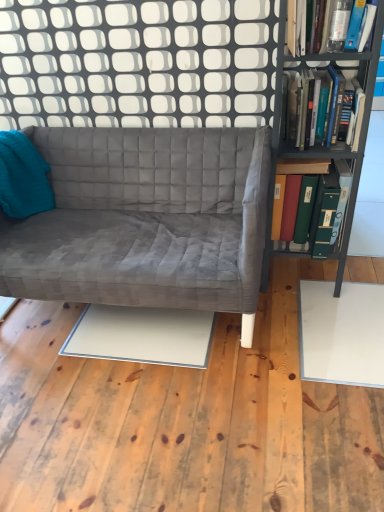
Describe the element at coordinates (320, 208) in the screenshot. The height and width of the screenshot is (512, 384). I see `green matte folder at right, the third book viewed from the top` at that location.

Describe the element at coordinates (23, 177) in the screenshot. I see `teal fabric throw pillow at left` at that location.

The width and height of the screenshot is (384, 512). What are the coordinates of `transparent glass door at upper center` in the screenshot? It's located at (138, 63).

What is the approximate width of hardcover books at right, which ranks as the second book in top-to-bottom order?

It is 33.45 centimeters.

The height and width of the screenshot is (512, 384). Describe the element at coordinates (325, 22) in the screenshot. I see `matte plastic book at upper right, placed as the third book when sorted from bottom to top` at that location.

In order to face matte plastic book at upper right, placed as the third book when sorted from bottom to top, should I rotate leftwards or rightwards?

You should rotate right by 18.148 degrees.

Image resolution: width=384 pixels, height=512 pixels. Describe the element at coordinates (323, 148) in the screenshot. I see `metallic gray bookcase at right` at that location.

This screenshot has height=512, width=384. I want to click on green matte folder at right, the third book viewed from the top, so click(320, 208).

Measure the distance from green matte folder at right, the third book viewed from the top, to teal fabric throw pillow at left.

green matte folder at right, the third book viewed from the top, and teal fabric throw pillow at left are 1.21 meters apart from each other.

Considering the points (313, 196) and (7, 179), which point is in front, point (313, 196) or point (7, 179)?

The point (313, 196) is more forward.

Based on the photo, are green matte folder at right, marked as the first book in a bottom-to-top arrangement, and teal fabric throw pillow at left far apart?

Indeed, green matte folder at right, marked as the first book in a bottom-to-top arrangement, is not near teal fabric throw pillow at left.

Can you confirm if green matte folder at right, the third book viewed from the top, is thinner than teal fabric throw pillow at left?

No, green matte folder at right, the third book viewed from the top, is not thinner than teal fabric throw pillow at left.

Looking at this image, is transparent glass door at upper center inside hardcover books at right, which ranks as the second book in top-to-bottom order?

No, transparent glass door at upper center is not a part of hardcover books at right, which ranks as the second book in top-to-bottom order.

Is the position of hardcover books at right, which ranks as the second book in top-to-bottom order, more distant than that of transparent glass door at upper center?

That is False.

Measure the distance between hardcover books at right, which is the 2th book from bottom to top, and transparent glass door at upper center.

hardcover books at right, which is the 2th book from bottom to top, is 19.53 inches from transparent glass door at upper center.

From the picture: Is hardcover books at right, which is the 2th book from bottom to top, turned away from transparent glass door at upper center?

Correct, hardcover books at right, which is the 2th book from bottom to top, is looking away from transparent glass door at upper center.

Could you tell me if teal fabric throw pillow at left is turned towards transparent glass door at upper center?

No, teal fabric throw pillow at left is not turned towards transparent glass door at upper center.

Based on the photo, is teal fabric throw pillow at left taller than transparent glass door at upper center?

Incorrect, the height of teal fabric throw pillow at left is not larger of that of transparent glass door at upper center.

Is teal fabric throw pillow at left further to camera compared to transparent glass door at upper center?

Yes, it is behind transparent glass door at upper center.

Between teal fabric throw pillow at left and transparent glass door at upper center, which one has larger width?

With larger width is teal fabric throw pillow at left.

Is matte plastic book at upper right, placed as the third book when sorted from bottom to top, inside hardcover books at right, which is the 2th book from bottom to top?

No, matte plastic book at upper right, placed as the third book when sorted from bottom to top, is not inside hardcover books at right, which is the 2th book from bottom to top.

Is hardcover books at right, which is the 2th book from bottom to top, at the right side of matte plastic book at upper right, placed as the third book when sorted from bottom to top?

Yes, hardcover books at right, which is the 2th book from bottom to top, is to the right of matte plastic book at upper right, placed as the third book when sorted from bottom to top.

Between hardcover books at right, which ranks as the second book in top-to-bottom order, and matte plastic book at upper right, placed as the third book when sorted from bottom to top, which one has less height?

matte plastic book at upper right, placed as the third book when sorted from bottom to top, is shorter.

Considering the relative sizes of hardcover books at right, which is the 2th book from bottom to top, and matte plastic book at upper right, arranged as the 1th book when viewed from the top, in the image provided, is hardcover books at right, which is the 2th book from bottom to top, bigger than matte plastic book at upper right, arranged as the 1th book when viewed from the top,?

Indeed, hardcover books at right, which is the 2th book from bottom to top, has a larger size compared to matte plastic book at upper right, arranged as the 1th book when viewed from the top.

Which object is wider, transparent glass door at upper center or green matte folder at right, marked as the first book in a bottom-to-top arrangement?

green matte folder at right, marked as the first book in a bottom-to-top arrangement, is wider.

From a real-world perspective, between transparent glass door at upper center and green matte folder at right, marked as the first book in a bottom-to-top arrangement, who is vertically higher?

transparent glass door at upper center, from a real-world perspective.

In the scene shown: Choose the correct answer: Is transparent glass door at upper center inside green matte folder at right, the third book viewed from the top, or outside it?

transparent glass door at upper center exists outside the volume of green matte folder at right, the third book viewed from the top.

Which of these two, teal fabric throw pillow at left or white glossy plywood at lower center, is wider?

With larger width is white glossy plywood at lower center.

Considering the sizes of objects teal fabric throw pillow at left and white glossy plywood at lower center in the image provided, who is taller, teal fabric throw pillow at left or white glossy plywood at lower center?

teal fabric throw pillow at left.

Relative to white glossy plywood at lower center, is teal fabric throw pillow at left in front or behind?

teal fabric throw pillow at left is behind white glossy plywood at lower center.

Is teal fabric throw pillow at left surrounding white glossy plywood at lower center?

No, white glossy plywood at lower center is located outside of teal fabric throw pillow at left.

Which is in front, point (295, 0) or point (379, 451)?

Point (379, 451)

Does matte plastic book at upper right, placed as the third book when sorted from bottom to top, have a lesser width compared to white glossy plywood at lower center?

Indeed, matte plastic book at upper right, placed as the third book when sorted from bottom to top, has a lesser width compared to white glossy plywood at lower center.

Considering the sizes of objects matte plastic book at upper right, placed as the third book when sorted from bottom to top, and white glossy plywood at lower center in the image provided, who is smaller, matte plastic book at upper right, placed as the third book when sorted from bottom to top, or white glossy plywood at lower center?

With smaller size is matte plastic book at upper right, placed as the third book when sorted from bottom to top.

Image resolution: width=384 pixels, height=512 pixels. In order to click on throw pillow behind the green matte folder at right, the third book viewed from the top in this screenshot , I will do `click(23, 177)`.

Which book is the 1st one when counting from the front of the transparent glass door at upper center? Please provide its 2D coordinates.

[(319, 106)]

When comparing their distances from matte plastic book at upper right, placed as the third book when sorted from bottom to top, does white glossy plywood at lower center or transparent glass door at upper center seem closer?

Among the two, transparent glass door at upper center is located nearer to matte plastic book at upper right, placed as the third book when sorted from bottom to top.

From the image, which object appears to be nearer to hardcover books at right, which ranks as the second book in top-to-bottom order, teal fabric throw pillow at left or velvet gray couch at center?

Based on the image, velvet gray couch at center appears to be nearer to hardcover books at right, which ranks as the second book in top-to-bottom order.

Based on their spatial positions, is velvet gray couch at center or matte plastic book at upper right, placed as the third book when sorted from bottom to top, further from teal fabric throw pillow at left?

Based on the image, matte plastic book at upper right, placed as the third book when sorted from bottom to top, appears to be further to teal fabric throw pillow at left.

Which object lies nearer to the anchor point hardcover books at right, which ranks as the second book in top-to-bottom order, teal fabric throw pillow at left or white glossy plywood at lower center?

Among the two, white glossy plywood at lower center is located nearer to hardcover books at right, which ranks as the second book in top-to-bottom order.

Estimate the real-world distances between objects in this image. Which object is closer to hardcover books at right, which is the 2th book from bottom to top, matte plastic book at upper right, placed as the third book when sorted from bottom to top, or metallic gray bookcase at right?

Among the two, metallic gray bookcase at right is located nearer to hardcover books at right, which is the 2th book from bottom to top.

Looking at the image, which one is located further to white glossy plywood at lower center, transparent glass door at upper center or matte plastic book at upper right, arranged as the 1th book when viewed from the top?

matte plastic book at upper right, arranged as the 1th book when viewed from the top, is positioned further to the anchor white glossy plywood at lower center.

Looking at this image, which object lies further to the anchor point transparent glass door at upper center, metallic gray bookcase at right or velvet gray couch at center?

metallic gray bookcase at right.

Considering their positions, is metallic gray bookcase at right positioned closer to teal fabric throw pillow at left than velvet gray couch at center?

velvet gray couch at center is closer to teal fabric throw pillow at left.

The image size is (384, 512). Identify the location of bookcase that lies between transparent glass door at upper center and white glossy plywood at lower center from top to bottom. (323, 148).

Locate an element on the screen. glass door located between teal fabric throw pillow at left and metallic gray bookcase at right in the left-right direction is located at coordinates (138, 63).

Find the location of `studio couch between teal fabric throw pillow at left and green matte folder at right, marked as the first book in a bottom-to-top arrangement, in the horizontal direction`. studio couch between teal fabric throw pillow at left and green matte folder at right, marked as the first book in a bottom-to-top arrangement, in the horizontal direction is located at coordinates (146, 220).

Where is `studio couch between teal fabric throw pillow at left and transparent glass door at upper center`? The image size is (384, 512). studio couch between teal fabric throw pillow at left and transparent glass door at upper center is located at coordinates (146, 220).